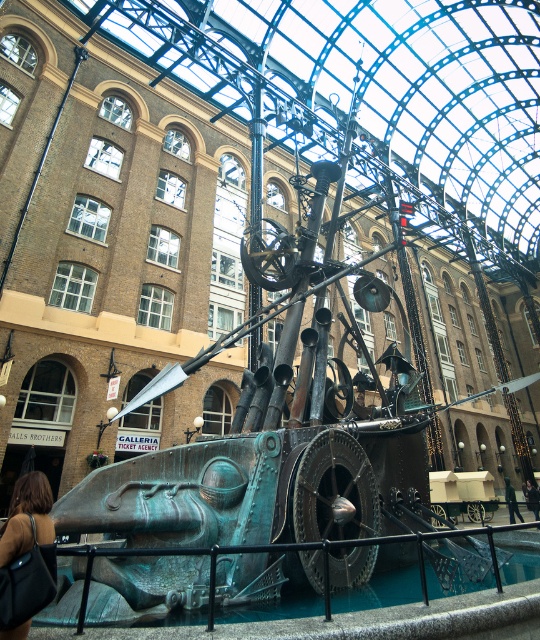
Question: Can you confirm if brown leather bag at lower left is wider than dark brown leather jacket at lower center?

Choices:
 (A) yes
 (B) no

Answer: (B)

Question: Is brown leather bag at lower left to the right of green fabric jacket at lower right from the viewer's perspective?

Choices:
 (A) yes
 (B) no

Answer: (B)

Question: Which point appears closest to the camera in this image?

Choices:
 (A) (532, 500)
 (B) (510, 499)
 (C) (30, 500)

Answer: (C)

Question: Which point is closer to the camera?

Choices:
 (A) brown leather bag at lower left
 (B) dark brown leather jacket at lower center
 (C) green fabric jacket at lower right

Answer: (A)

Question: Can you confirm if brown leather bag at lower left is bigger than dark brown leather jacket at lower center?

Choices:
 (A) no
 (B) yes

Answer: (A)

Question: Which point appears farthest from the camera in this image?

Choices:
 (A) (509, 492)
 (B) (10, 579)

Answer: (A)